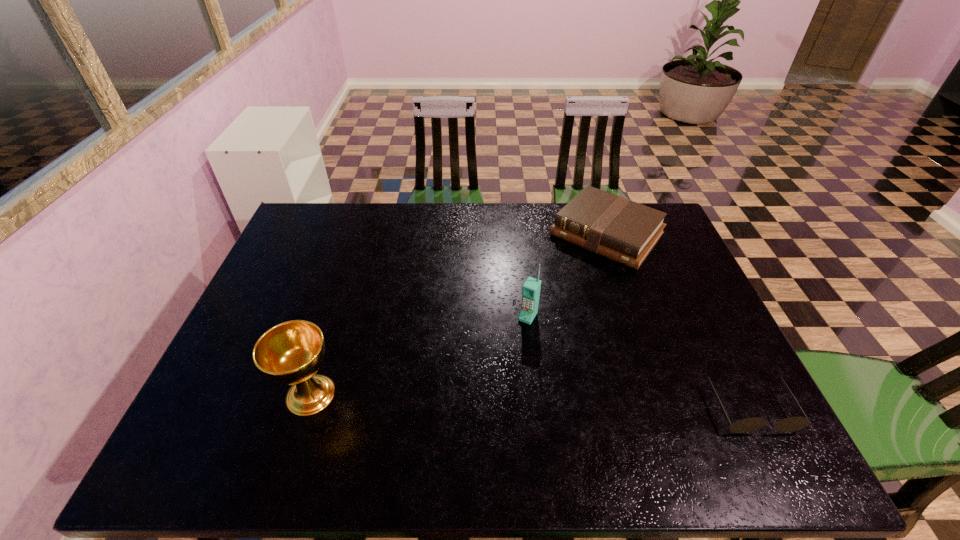
Find the location of a particular element. The image size is (960, 540). free space in the image that satisfies the following two spatial constraints: 1. on the back side of the second farthest object; 2. on the right side of the leftmost object is located at coordinates (336, 316).

You are a GUI agent. You are given a task and a screenshot of the screen. Output one action in this format:
    pyautogui.click(x=<x>, y=<y>)
    Task: Click on the free space in the image that satisfies the following two spatial constraints: 1. on the back side of the leftmost object; 2. on the right side of the second object from left to right
    The height and width of the screenshot is (540, 960).
    Given the screenshot: What is the action you would take?
    pyautogui.click(x=336, y=316)